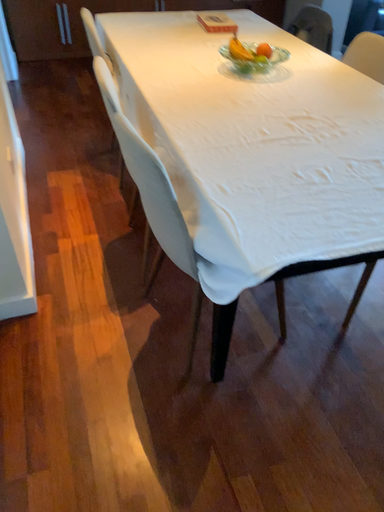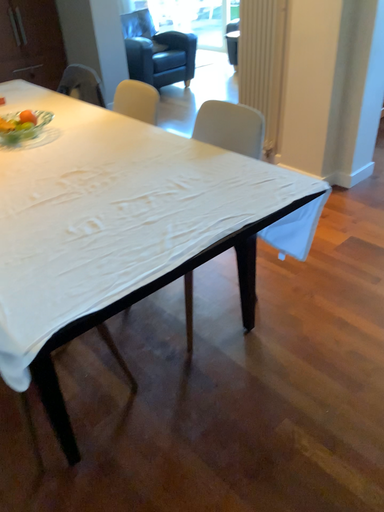
Question: Which way did the camera rotate in the video?

Choices:
 (A) rotated upward
 (B) rotated downward

Answer: (A)